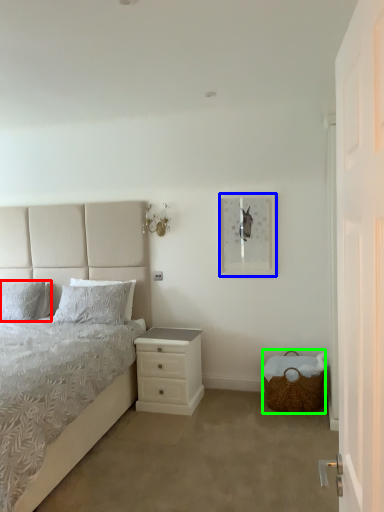
Question: Based on their relative distances, which object is farther from pillow (highlighted by a red box)? Choose from picture frame (highlighted by a blue box) and basket (highlighted by a green box).

Choices:
 (A) picture frame
 (B) basket

Answer: (B)